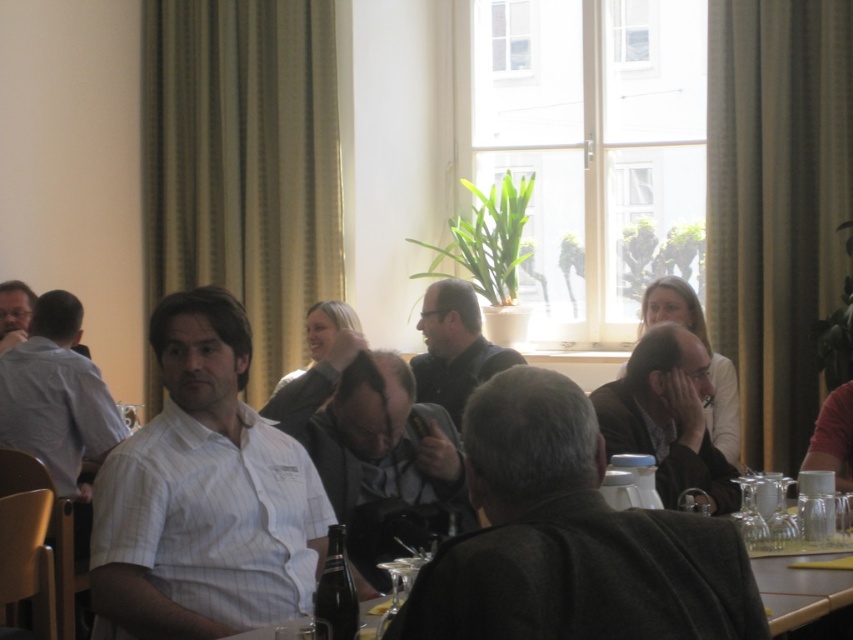
You are organizing a wine tasting event and need to ensure there is enough space on the table for all items. The table has limited space, and you must place both the green textured curtain at right and the dark brown leather jacket at center. Which object requires more space on the table?

The green textured curtain at right requires more space on the table because it is bigger than the dark brown leather jacket at center.

You are standing in the conference room and want to move from point A to point B. Point A is located at coordinates point (769, 442) and point B is at point (683, 454). Which point is closer to you?

Point A at point (769, 442) is closer to you because it is further to the viewer than point B at point (683, 454).